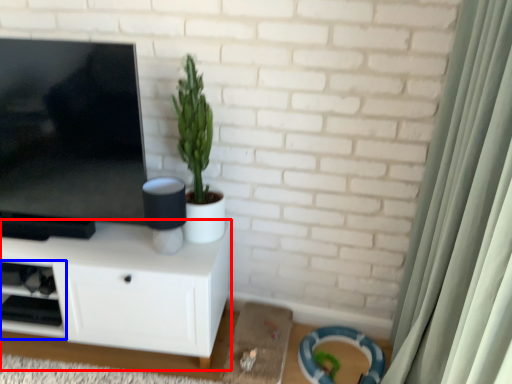
Question: Which of the following is the closest to the observer, cabinetry (highlighted by a red box) or shelf (highlighted by a blue box)?

Choices:
 (A) cabinetry
 (B) shelf

Answer: (A)